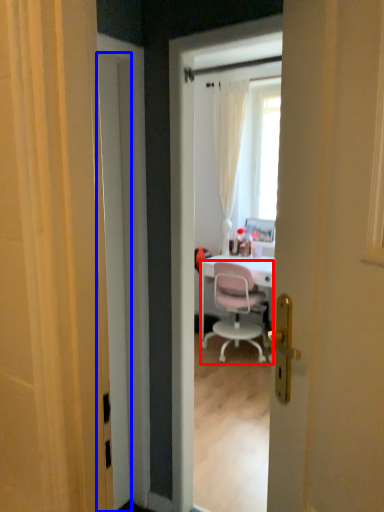
Question: Which point is closer to the camera, chair (highlighted by a red box) or door (highlighted by a blue box)?

Choices:
 (A) chair
 (B) door

Answer: (B)